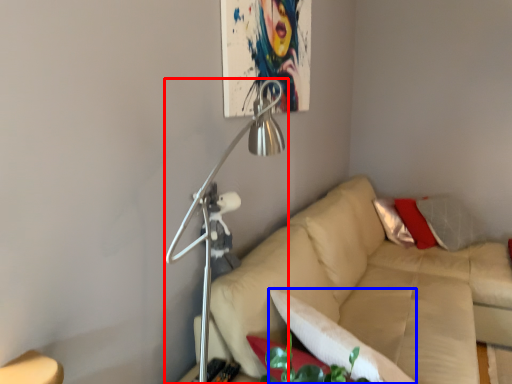
Question: Among these objects, which one is nearest to the camera, lamp (highlighted by a red box) or pillow (highlighted by a blue box)?

Choices:
 (A) lamp
 (B) pillow

Answer: (A)